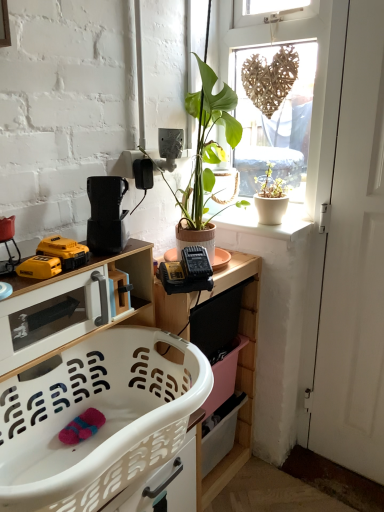
Question: In terms of width, does white matte door at right look wider or thinner when compared to white plastic laundry basket at lower left, arranged as the second cabinetry when viewed from the top?

Choices:
 (A) thin
 (B) wide

Answer: (A)

Question: Based on their sizes in the image, would you say white matte door at right is bigger or smaller than white plastic laundry basket at lower left, which ranks as the first cabinetry in bottom-to-top order?

Choices:
 (A) small
 (B) big

Answer: (A)

Question: Which object is positioned farthest from the yellow plastic drill at lower left, the 1th toy from the front?

Choices:
 (A) white matte door at right
 (B) white plastic laundry basket at lower left, which ranks as the first cabinetry in bottom-to-top order
 (C) wooden heart at upper right
 (D) yellow plastic drill at lower left, placed as the 2th toy when sorted from front to back
 (E) green matte plant at upper center

Answer: (A)

Question: Based on their relative distances, which object is nearer to the white plastic laundry basket at lower left, which ranks as the first cabinetry in bottom-to-top order?

Choices:
 (A) wooden heart at upper right
 (B) yellow plastic drill at lower left, placed as the 2th toy when sorted from front to back
 (C) green matte plant at upper center
 (D) white glossy cabinet at lower left, placed as the first cabinetry when sorted from top to bottom
 (E) black plastic coffee maker at upper left

Answer: (D)